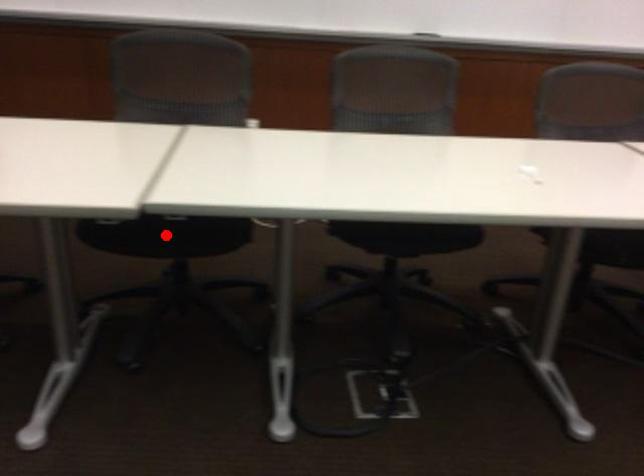
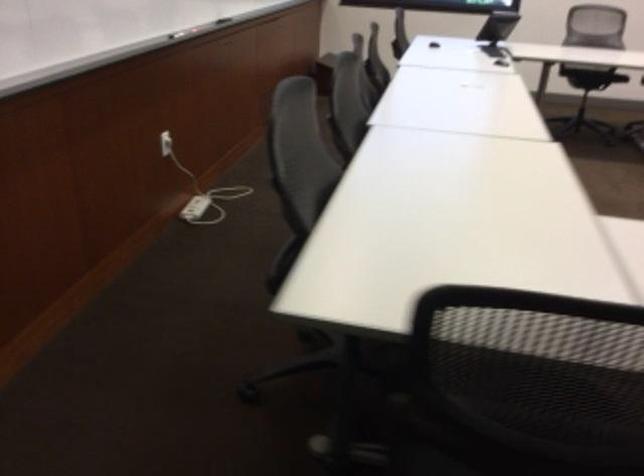
Question: I am providing you with two images of the same scene from different viewpoints. A red point is marked on the first image. Is the red point's position out of view in image 2?

Choices:
 (A) Yes
 (B) No

Answer: (A)